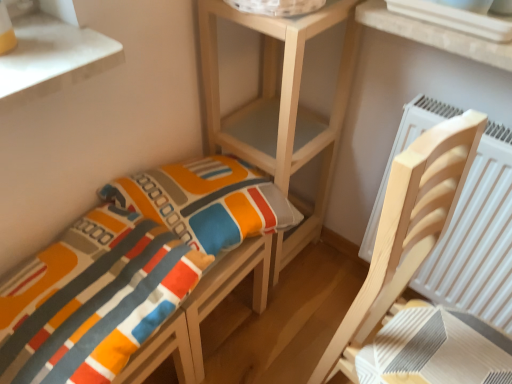
Question: From the image's perspective, is textured fabric cushion at lower left, the 1th furniture in the left-to-right sequence, located above or below wooden shelf at center?

Choices:
 (A) below
 (B) above

Answer: (A)

Question: From a real-world perspective, is textured fabric cushion at lower left, acting as the 2th furniture starting from the right, positioned above or below wooden shelf at center?

Choices:
 (A) below
 (B) above

Answer: (B)

Question: Which is nearer to the white plastic window at upper right?

Choices:
 (A) wooden shelf at center
 (B) textured fabric cushion at lower left, acting as the 2th furniture starting from the right
 (C) light wood chair at right, acting as the 2th furniture starting from the left

Answer: (A)

Question: Which of these objects is positioned closest to the wooden shelf at center?

Choices:
 (A) textured fabric cushion at lower left, the 1th furniture in the left-to-right sequence
 (B) light wood chair at right, acting as the 2th furniture starting from the left
 (C) white plastic window at upper right

Answer: (A)